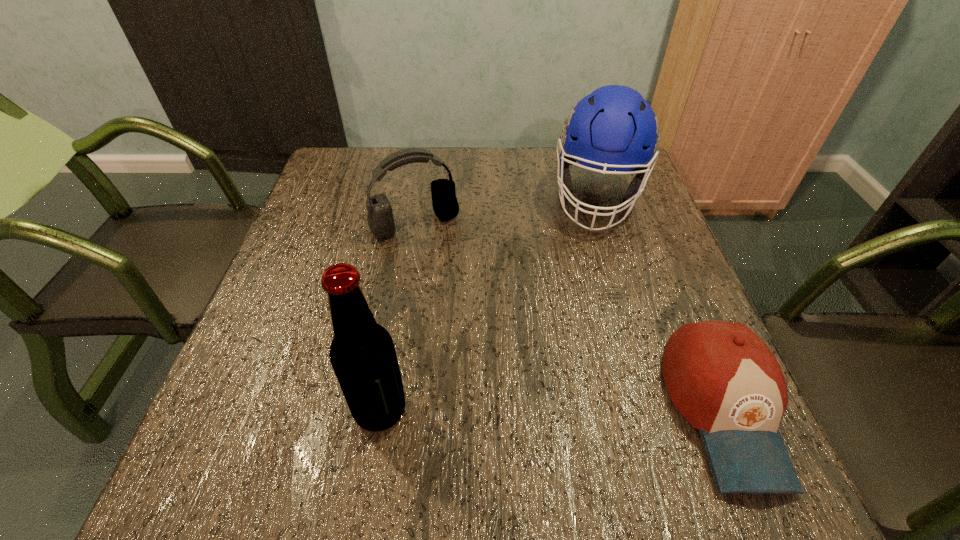
Where is `beer bottle`? The height and width of the screenshot is (540, 960). beer bottle is located at coordinates (362, 353).

Where is `the shortest object`? the shortest object is located at coordinates (723, 379).

Identify the location of headset. (380, 219).

At what (x,y) coordinates should I click in order to perform the action: click on the second tallest object. Please return your answer as a coordinate pair (x, y). Looking at the image, I should click on (613, 128).

You are a GUI agent. You are given a task and a screenshot of the screen. Output one action in this format:
    pyautogui.click(x=<x>, y=<y>)
    Task: Click on the free space located on the back of the beer bottle
    This screenshot has height=540, width=960.
    Given the screenshot: What is the action you would take?
    point(406,258)

Identify the location of vacant point located on the headband of the second shortest object. This screenshot has height=540, width=960. (469, 307).

You are a GUI agent. You are given a task and a screenshot of the screen. Output one action in this format:
    pyautogui.click(x=<x>, y=<y>)
    Task: Click on the vacant position located on the headband of the second shortest object
    
    Given the screenshot: What is the action you would take?
    pyautogui.click(x=463, y=294)

At what (x,y) coordinates should I click in order to perform the action: click on vacant region located on the headband of the second shortest object. Please return your answer as a coordinate pair (x, y). This screenshot has width=960, height=540. Looking at the image, I should click on (469, 307).

Where is `blank space located 0.400m on the face guard of the football helmet`? Image resolution: width=960 pixels, height=540 pixels. blank space located 0.400m on the face guard of the football helmet is located at coordinates (578, 376).

The image size is (960, 540). I want to click on free region located on the face guard of the football helmet, so click(x=588, y=296).